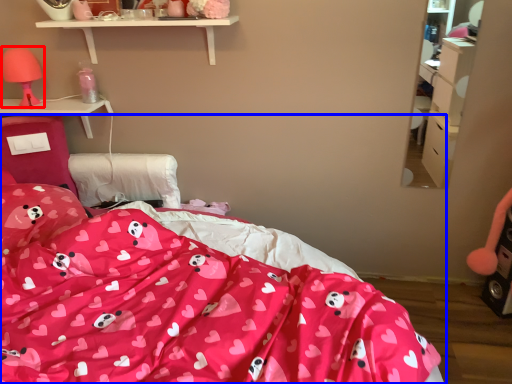
Question: Which object appears closest to the camera in this image, table lamp (highlighted by a red box) or bed (highlighted by a blue box)?

Choices:
 (A) table lamp
 (B) bed

Answer: (B)